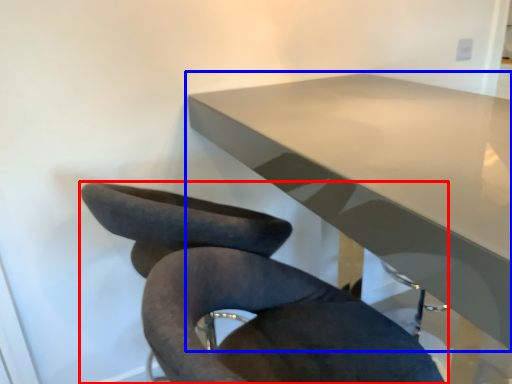
Question: Which point is further to the camera, chair (highlighted by a red box) or table (highlighted by a blue box)?

Choices:
 (A) chair
 (B) table

Answer: (B)